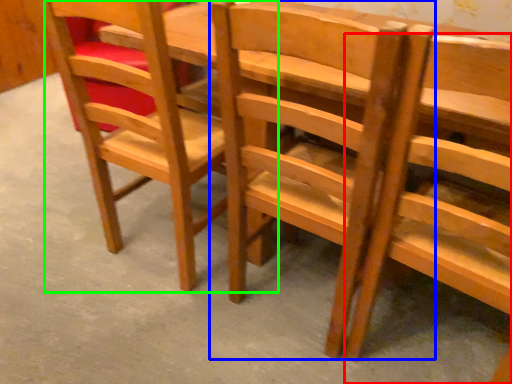
Question: Considering the real-world distances, which object is closest to chair (highlighted by a red box)? chair (highlighted by a blue box) or chair (highlighted by a green box).

Choices:
 (A) chair
 (B) chair

Answer: (A)